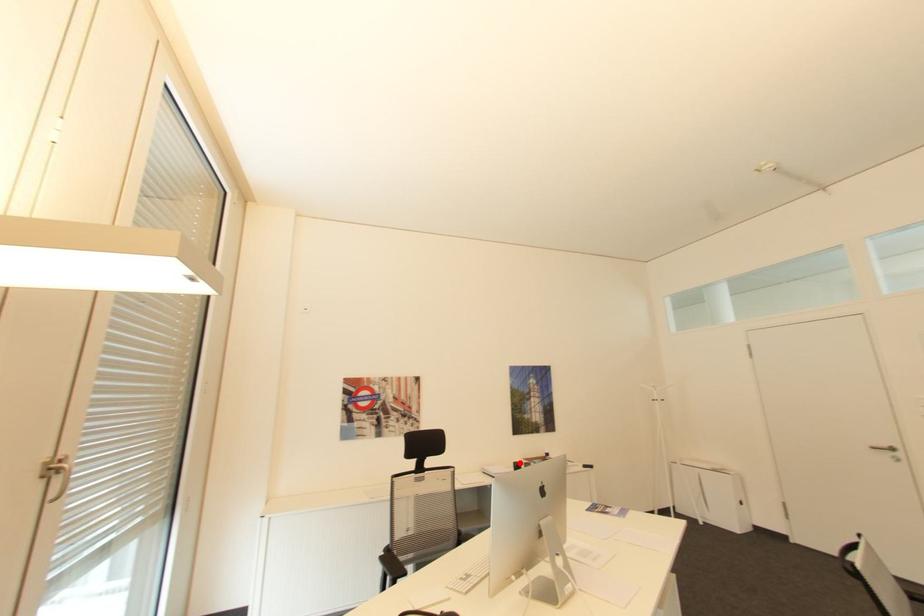
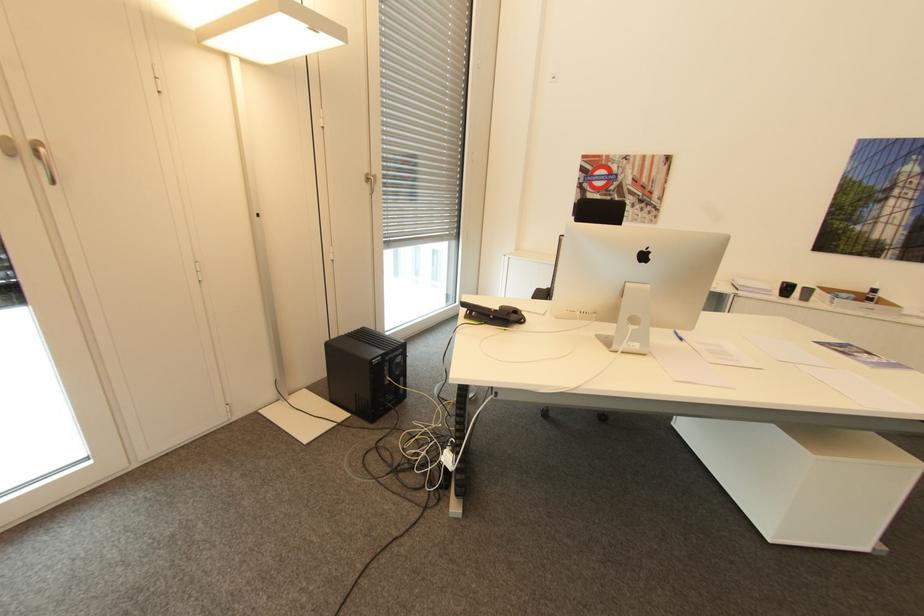
Where in the second image is the point corresponding to the highlighted location from the first image?

(788, 283)